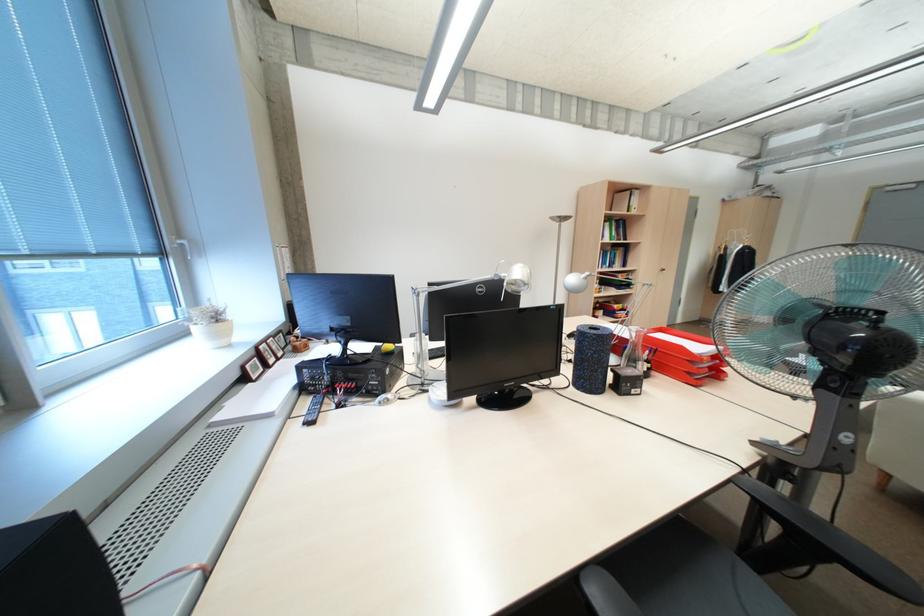
Find where to adjust the silver desk lamp head. Please return your answer as a coordinate pair (x, y).

(517, 278)